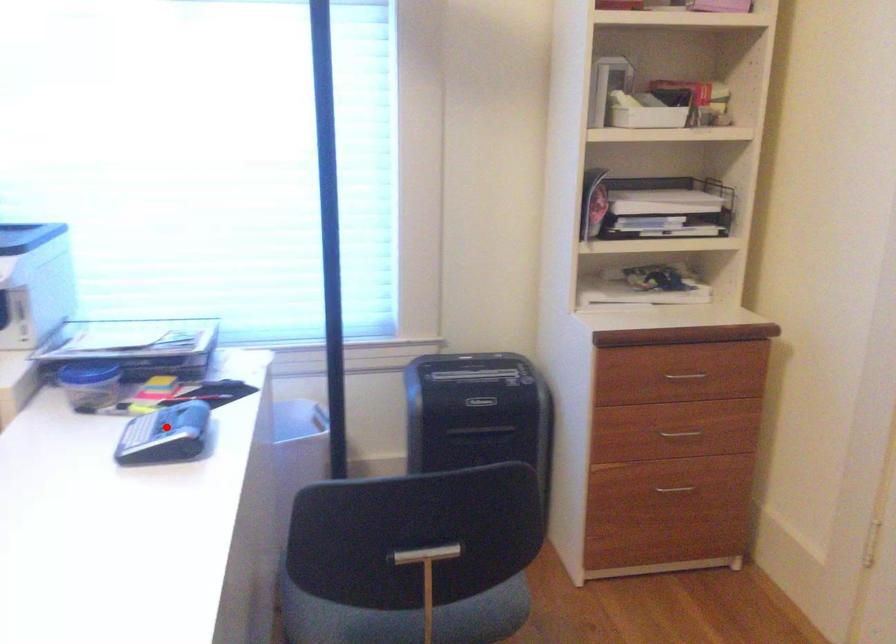
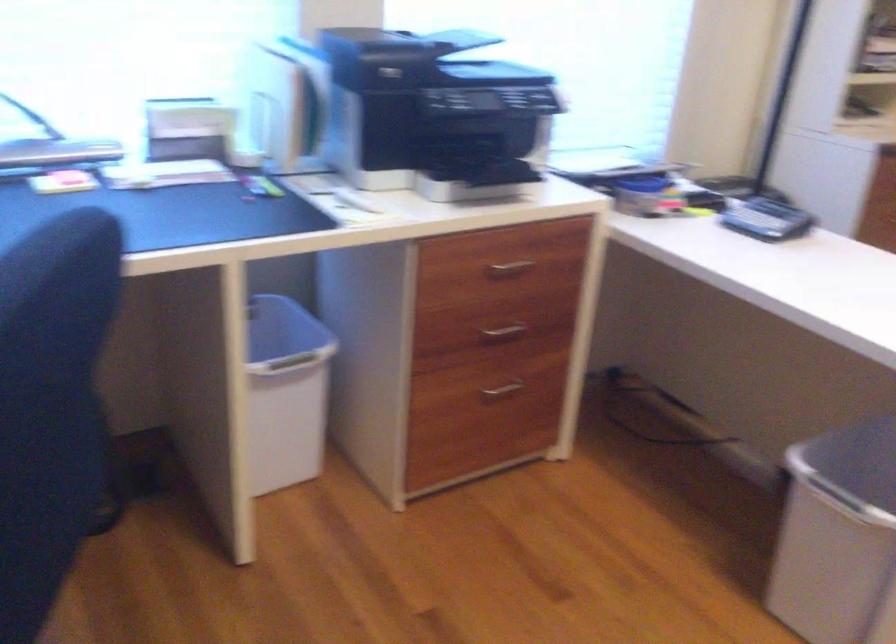
Question: I am providing you with two images of the same scene from different viewpoints. A red point is shown in image1. For the corresponding object point in image2, is it positioned nearer or farther from the camera?

Choices:
 (A) Nearer
 (B) Farther

Answer: (B)